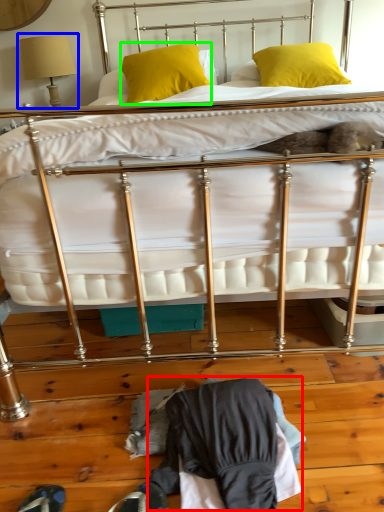
Question: Which object is the farthest from clothing (highlighted by a red box)? Choose among these: table lamp (highlighted by a blue box) or pillow (highlighted by a green box).

Choices:
 (A) table lamp
 (B) pillow

Answer: (A)